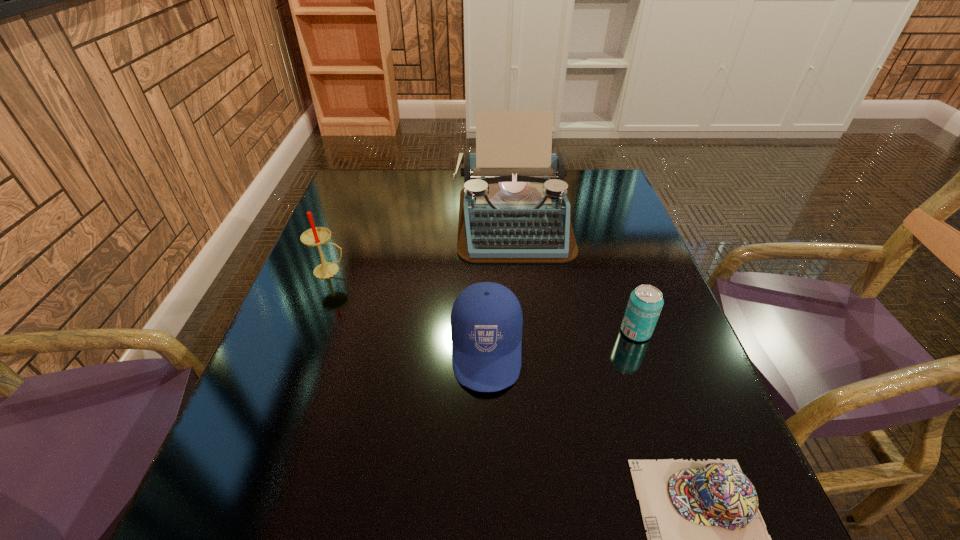
At what (x,y) coordinates should I click in order to perform the action: click on free space between the beer can and the left cap. Please return your answer as a coordinate pair (x, y). This screenshot has width=960, height=540. Looking at the image, I should click on (562, 340).

Locate an element on the screen. the closest object to the nearest object is located at coordinates (486, 319).

Find the location of `object that ranks as the second closest to the leftmost object`. object that ranks as the second closest to the leftmost object is located at coordinates (486, 319).

The height and width of the screenshot is (540, 960). In order to click on free space that satisfies the following two spatial constraints: 1. on the typing side of the tallest object; 2. on the right side of the beer can in this screenshot , I will do `click(523, 332)`.